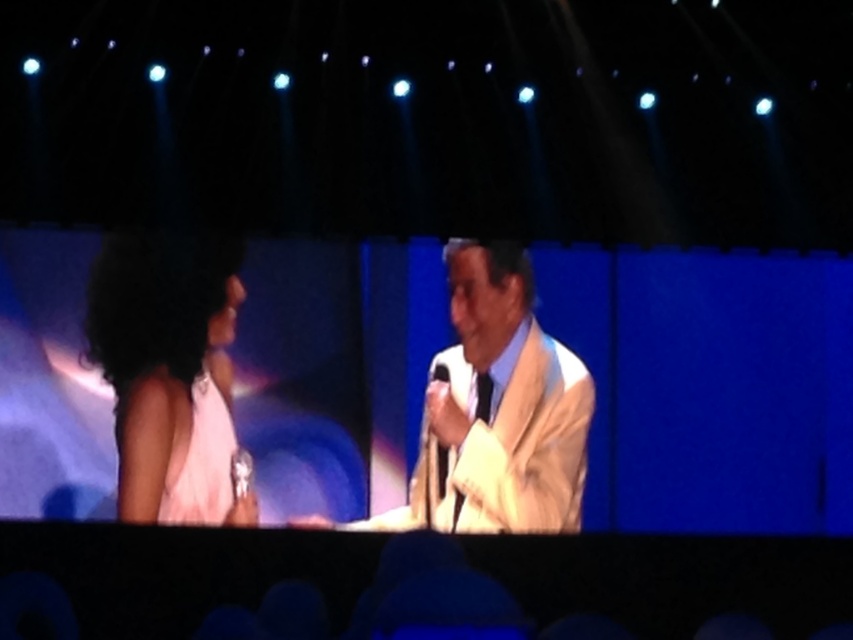
Is light beige suit at center behind metallic silver microphone at center?

No, light beige suit at center is in front of metallic silver microphone at center.

Is light beige suit at center taller than metallic silver microphone at center?

Yes, light beige suit at center is taller than metallic silver microphone at center.

Which is in front, point (525, 520) or point (444, 468)?

Point (444, 468)

I want to click on light beige suit at center, so click(x=500, y=408).

Between light beige suit at center and matte white dress at left, which one is positioned lower?

matte white dress at left is below.

Can you confirm if light beige suit at center is smaller than matte white dress at left?

Actually, light beige suit at center might be larger than matte white dress at left.

The image size is (853, 640). What are the coordinates of `light beige suit at center` in the screenshot? It's located at [500, 408].

At what (x,y) coordinates should I click in order to perform the action: click on light beige suit at center. Please return your answer as a coordinate pair (x, y). The image size is (853, 640). Looking at the image, I should click on (500, 408).

Which is in front, point (459, 515) or point (151, 518)?

Positioned in front is point (151, 518).

Does point (457, 259) come behind point (138, 467)?

That is True.

This screenshot has width=853, height=640. I want to click on light beige suit at center, so click(x=500, y=408).